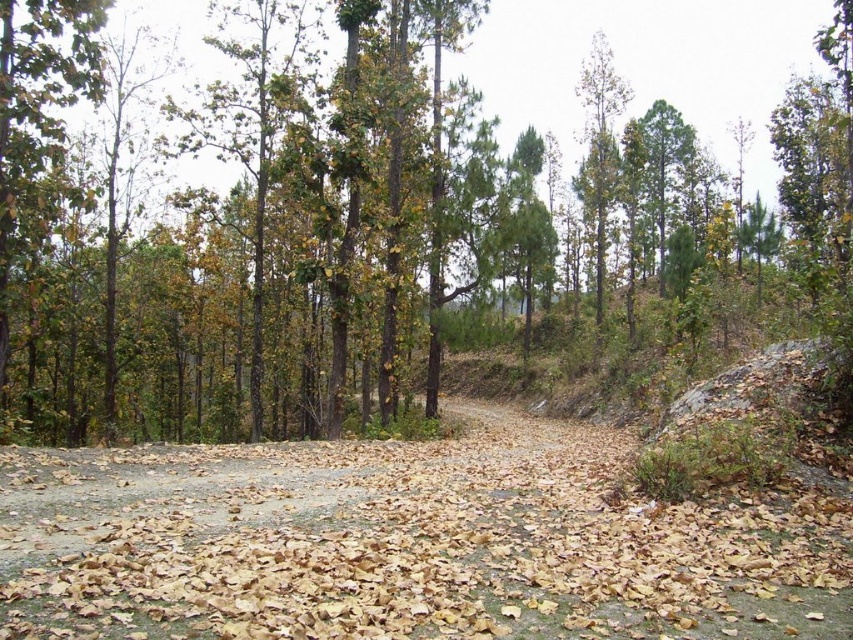
Question: Is brown matte tree at center thinner than brown dirt track at center?

Choices:
 (A) yes
 (B) no

Answer: (B)

Question: Which point is closer to the camera?

Choices:
 (A) (271, 58)
 (B) (389, 481)

Answer: (B)

Question: Is brown matte tree at center below brown dirt track at center?

Choices:
 (A) yes
 (B) no

Answer: (B)

Question: Is the position of brown matte tree at center more distant than that of brown dirt track at center?

Choices:
 (A) yes
 (B) no

Answer: (A)

Question: Which point appears farthest from the camera in this image?

Choices:
 (A) (169, 230)
 (B) (468, 433)

Answer: (A)

Question: Which object is closer to the camera taking this photo?

Choices:
 (A) brown matte tree at center
 (B) brown dirt track at center

Answer: (B)